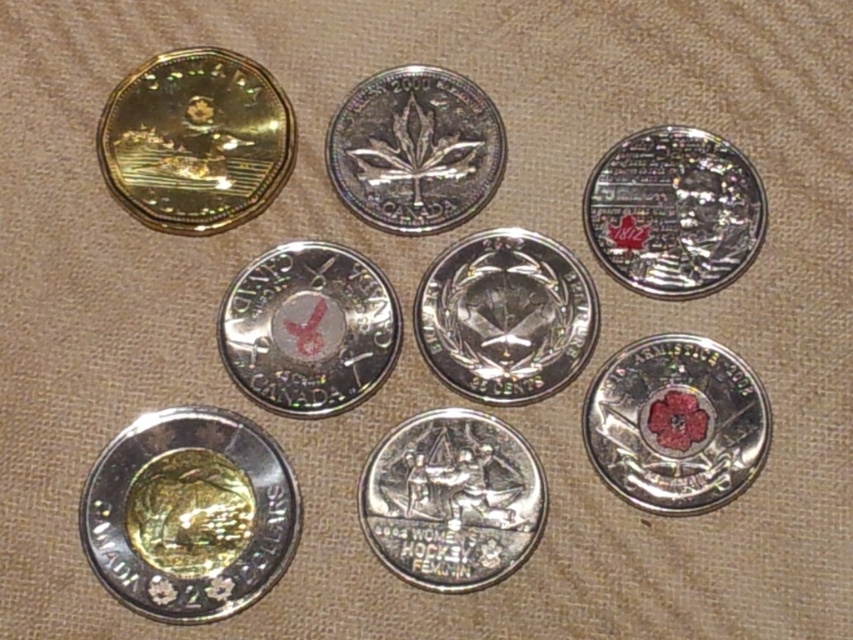
Question: Where is gold holographic coin at upper left located in relation to glossy silver poppy at center in the image?

Choices:
 (A) right
 (B) left

Answer: (B)

Question: Which point is farther to the camera?

Choices:
 (A) silver/metallic coin at upper right
 (B) silver/metallic maple leaf at center

Answer: (B)

Question: Is shiny gold coin at bottom left further to camera compared to glossy silver poppy at center?

Choices:
 (A) no
 (B) yes

Answer: (A)

Question: Is gold holographic coin at upper left bigger than glossy silver coin at center?

Choices:
 (A) no
 (B) yes

Answer: (B)

Question: Which of the following is the farthest from the observer?

Choices:
 (A) silver/metallic hockey coin at center
 (B) shiny gold coin at bottom left
 (C) silver/metallic maple leaf at center
 (D) glossy silver poppy at center

Answer: (C)

Question: Which object is positioned closest to the silver/metallic maple leaf at center?

Choices:
 (A) gold holographic coin at upper left
 (B) silver/metallic coin at center
 (C) glossy silver coin at center

Answer: (C)